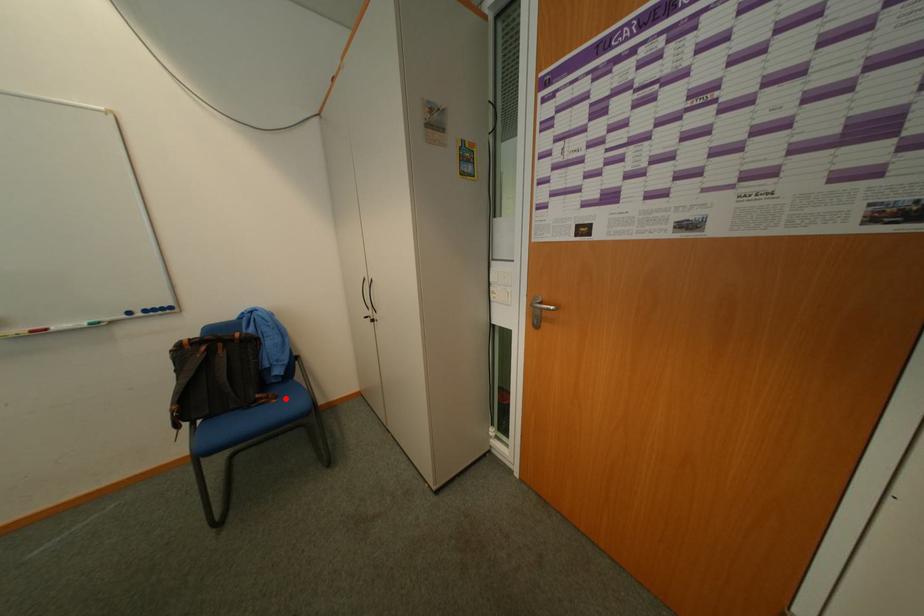
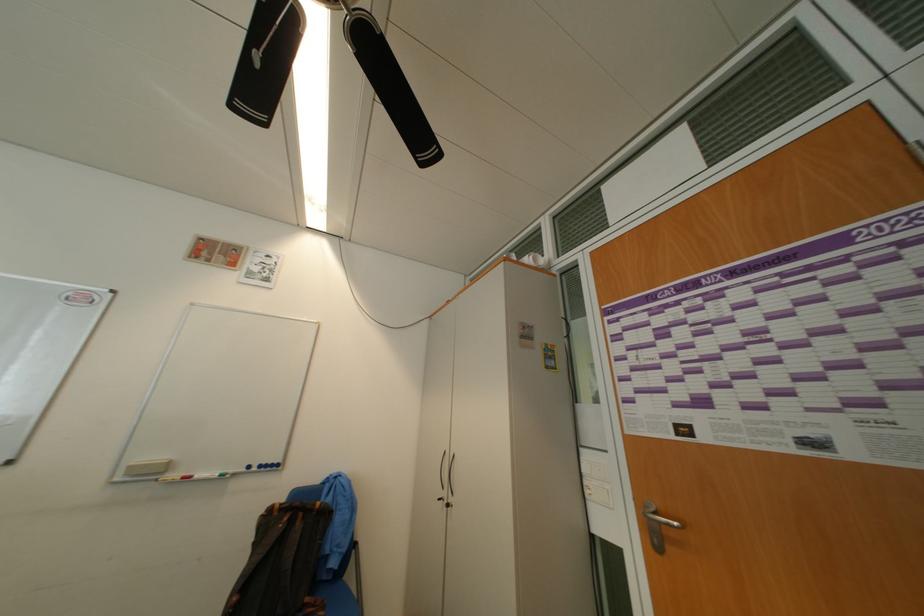
Question: I am providing you with two images of the same scene from different viewpoints. In image1, a red point is highlighted. Considering the same 3D point in image2, which of the following is correct?

Choices:
 (A) It is closer
 (B) It is farther

Answer: (B)